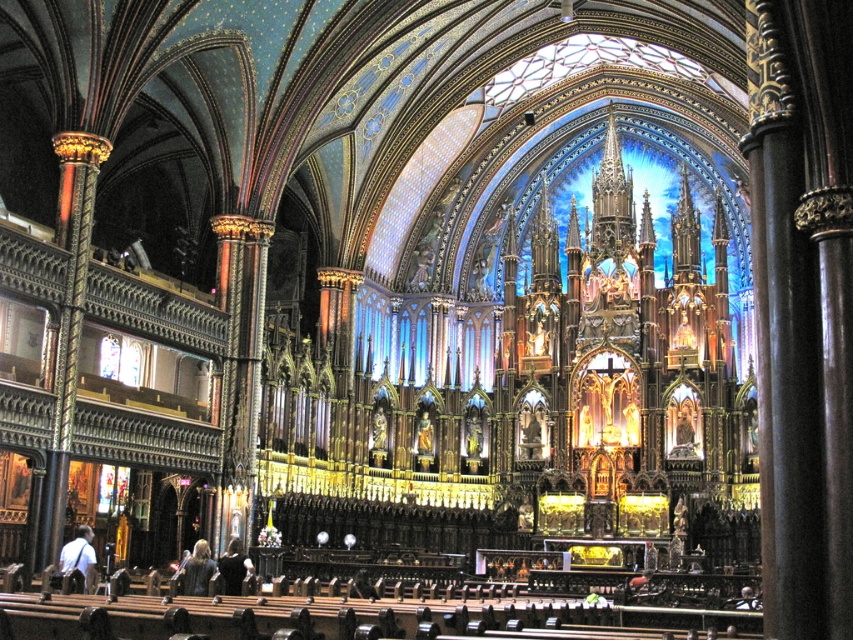
Who is more distant from viewer, (x=195, y=568) or (x=221, y=563)?

Point (x=221, y=563)

From the picture: Between dark brown leather jacket at lower center and dark brown leather jacket at lower left, which one appears on the right side from the viewer's perspective?

From the viewer's perspective, dark brown leather jacket at lower left appears more on the right side.

Is point (207, 564) positioned in front of point (245, 573)?

Yes, point (207, 564) is closer to viewer.

Image resolution: width=853 pixels, height=640 pixels. Find the location of `dark brown leather jacket at lower center`. dark brown leather jacket at lower center is located at coordinates (198, 570).

How far apart are white fabric bag at lower left and dark brown leather jacket at lower center?

white fabric bag at lower left is 6.23 meters from dark brown leather jacket at lower center.

Is the position of white fabric bag at lower left more distant than that of dark brown leather jacket at lower center?

No.

Describe the element at coordinates (77, 552) in the screenshot. The width and height of the screenshot is (853, 640). I see `white fabric bag at lower left` at that location.

Identify the location of white fabric bag at lower left. This screenshot has width=853, height=640. (77, 552).

Can you confirm if white fabric bag at lower left is positioned above dark brown leather jacket at lower left?

Indeed, white fabric bag at lower left is positioned over dark brown leather jacket at lower left.

Is white fabric bag at lower left to the left of dark brown leather jacket at lower left from the viewer's perspective?

Indeed, white fabric bag at lower left is positioned on the left side of dark brown leather jacket at lower left.

The image size is (853, 640). What do you see at coordinates (77, 552) in the screenshot?
I see `white fabric bag at lower left` at bounding box center [77, 552].

You are a GUI agent. You are given a task and a screenshot of the screen. Output one action in this format:
    pyautogui.click(x=<x>, y=<y>)
    Task: Click on the white fabric bag at lower left
    The width and height of the screenshot is (853, 640).
    Given the screenshot: What is the action you would take?
    pyautogui.click(x=77, y=552)